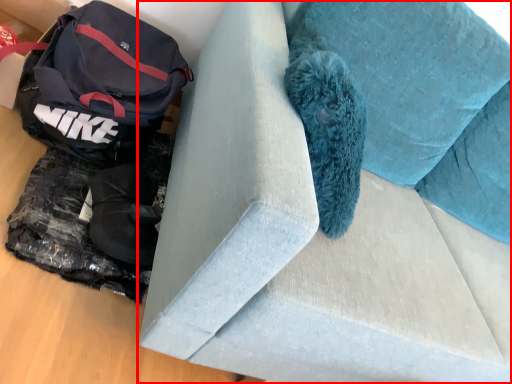
Question: Where is furniture (annotated by the red box) located in relation to luggage and bags in the image?

Choices:
 (A) left
 (B) right

Answer: (B)